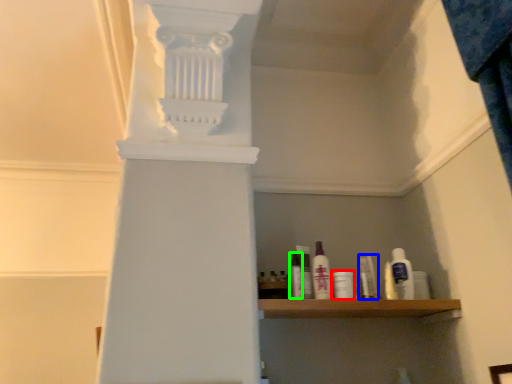
Question: Estimate the real-world distances between objects in this image. Which object is closer to toiletry (highlighted by a red box), toiletry (highlighted by a blue box) or toiletry (highlighted by a green box)?

Choices:
 (A) toiletry
 (B) toiletry

Answer: (A)